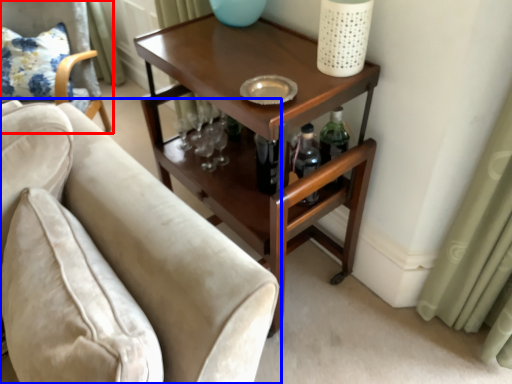
Question: Which point is closer to the camera, chair (highlighted by a red box) or studio couch (highlighted by a blue box)?

Choices:
 (A) chair
 (B) studio couch

Answer: (B)